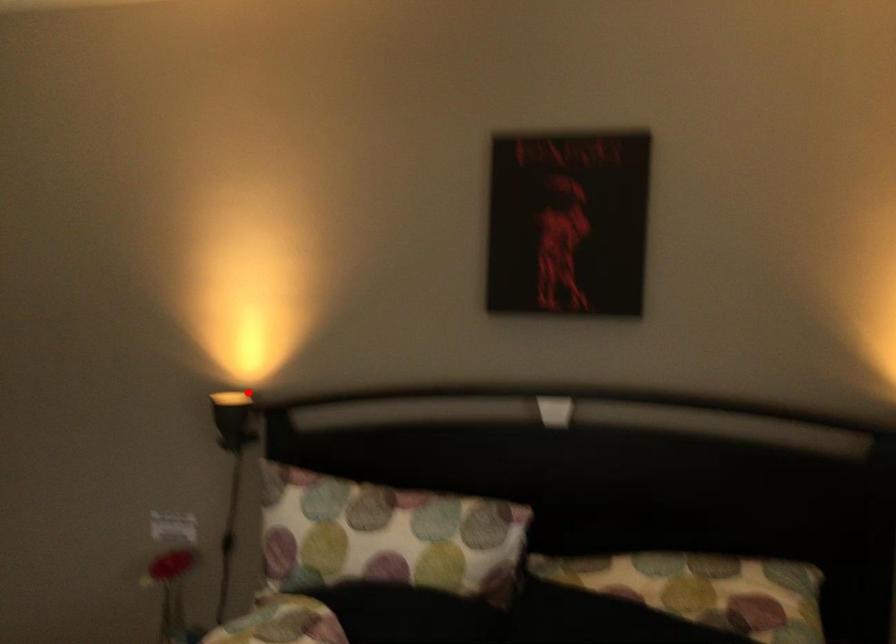
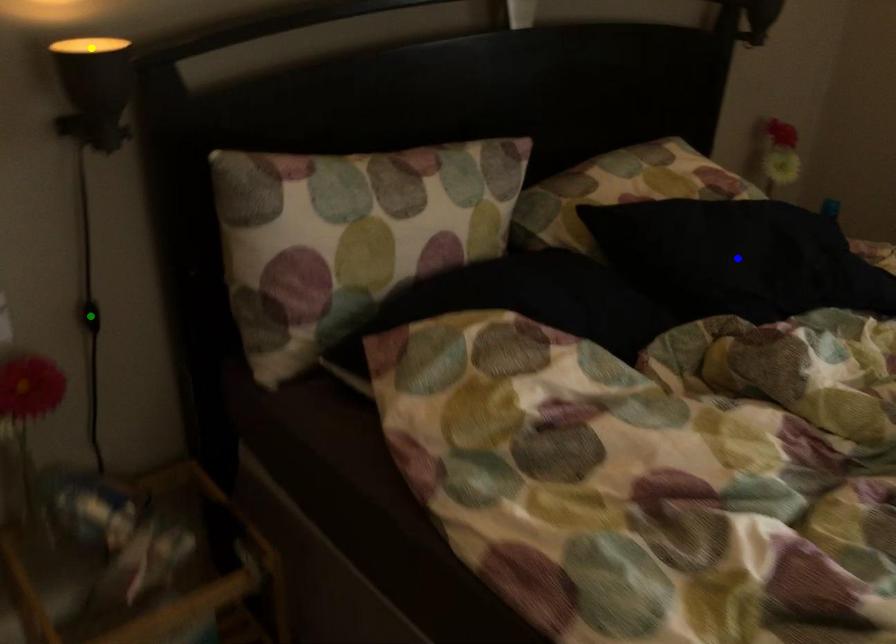
Question: I am providing you with two images of the same scene from different viewpoints. A red point is marked on the first image. You are given multiple points on the second image. Which spot in image 2 lines up with the point in image 1?

Choices:
 (A) yellow point
 (B) green point
 (C) blue point

Answer: (A)